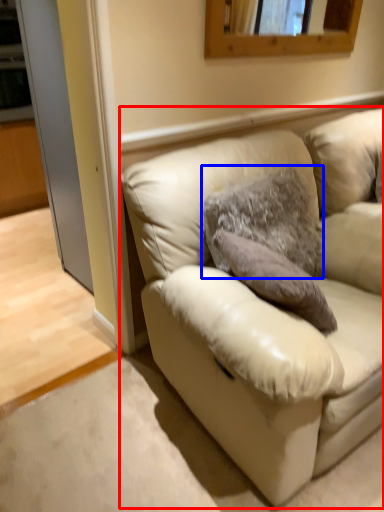
Question: Which point is closer to the camera, studio couch (highlighted by a red box) or pillow (highlighted by a blue box)?

Choices:
 (A) studio couch
 (B) pillow

Answer: (A)